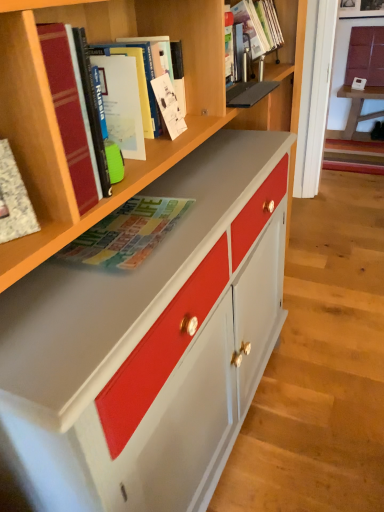
What do you see at coordinates (126, 234) in the screenshot?
I see `matte magazine at center, positioned as the third book in front-to-back order` at bounding box center [126, 234].

What is the approximate height of matte white cabinet at upper right?

matte white cabinet at upper right is 54.57 centimeters tall.

What do you see at coordinates (359, 109) in the screenshot?
I see `matte white table at upper right` at bounding box center [359, 109].

Identify the location of matte hardcover book at upper center, which is counted as the fourth book, starting from the front. (140, 76).

I want to click on white textured notebook at left, which is the 6th book from back to front, so click(14, 199).

Is matte hardcover book at upper center, marked as the 3th book in a back-to-front arrangement, positioned far away from matte plastic book at upper center, the first book positioned from the back?

No, matte hardcover book at upper center, marked as the 3th book in a back-to-front arrangement, is not far from matte plastic book at upper center, the first book positioned from the back.

Is matte hardcover book at upper center, marked as the 3th book in a back-to-front arrangement, facing towards matte plastic book at upper center, the first book positioned from the back?

No, matte hardcover book at upper center, marked as the 3th book in a back-to-front arrangement, is not aimed at matte plastic book at upper center, the first book positioned from the back.

Considering the sizes of objects matte hardcover book at upper center, which is counted as the fourth book, starting from the front, and matte plastic book at upper center, the first book positioned from the back, in the image provided, who is thinner, matte hardcover book at upper center, which is counted as the fourth book, starting from the front, or matte plastic book at upper center, the first book positioned from the back,?

matte hardcover book at upper center, which is counted as the fourth book, starting from the front.

Is point (114, 51) farther from viewer compared to point (274, 49)?

No, it is in front of (274, 49).

Is white paper at upper center, which appears as the fifth book when viewed from the front, outside of hardcover book at upper left, which ranks as the 5th book in back-to-front order?

Yes, white paper at upper center, which appears as the fifth book when viewed from the front, is outside of hardcover book at upper left, which ranks as the 5th book in back-to-front order.

Considering the relative sizes of white paper at upper center, which appears as the fifth book when viewed from the front, and hardcover book at upper left, which ranks as the 5th book in back-to-front order, in the image provided, is white paper at upper center, which appears as the fifth book when viewed from the front, wider than hardcover book at upper left, which ranks as the 5th book in back-to-front order,?

In fact, white paper at upper center, which appears as the fifth book when viewed from the front, might be narrower than hardcover book at upper left, which ranks as the 5th book in back-to-front order.

The height and width of the screenshot is (512, 384). Identify the location of the 3rd book behind when counting from the hardcover book at upper left, positioned as the second book in front-to-back order. (168, 105).

Is there a large distance between white paper at upper center, the second book from the back, and hardcover book at upper left, positioned as the second book in front-to-back order?

No, white paper at upper center, the second book from the back, is in close proximity to hardcover book at upper left, positioned as the second book in front-to-back order.

Consider the image. From a real-world perspective, is hardcover book at upper left, positioned as the second book in front-to-back order, positioned above or below matte plastic book at upper center, which is the 6th book from front to back?

Clearly, from a real-world perspective, hardcover book at upper left, positioned as the second book in front-to-back order, is below matte plastic book at upper center, which is the 6th book from front to back.

Is hardcover book at upper left, which ranks as the 5th book in back-to-front order, positioned far away from matte plastic book at upper center, which is the 6th book from front to back?

That's right, there is a large distance between hardcover book at upper left, which ranks as the 5th book in back-to-front order, and matte plastic book at upper center, which is the 6th book from front to back.

Between hardcover book at upper left, positioned as the second book in front-to-back order, and matte plastic book at upper center, the first book positioned from the back, which one has larger width?

hardcover book at upper left, positioned as the second book in front-to-back order.

From the picture: Is matte hardcover book at upper center, which is counted as the fourth book, starting from the front, bigger than matte white cabinet at upper right?

No, matte hardcover book at upper center, which is counted as the fourth book, starting from the front, is not bigger than matte white cabinet at upper right.

Does matte hardcover book at upper center, which is counted as the fourth book, starting from the front, have a greater width compared to matte white cabinet at upper right?

Correct, the width of matte hardcover book at upper center, which is counted as the fourth book, starting from the front, exceeds that of matte white cabinet at upper right.

Is matte hardcover book at upper center, marked as the 3th book in a back-to-front arrangement, inside or outside of matte white cabinet at upper right?

matte hardcover book at upper center, marked as the 3th book in a back-to-front arrangement, cannot be found inside matte white cabinet at upper right.

Between matte hardcover book at upper center, which is counted as the fourth book, starting from the front, and matte white cabinet at upper right, which one has less height?

matte hardcover book at upper center, which is counted as the fourth book, starting from the front.

Locate an element on the screen. The width and height of the screenshot is (384, 512). table that appears below the white paper at upper center, which appears as the fifth book when viewed from the front (from a real-world perspective) is located at coordinates (359, 109).

Is white paper at upper center, which appears as the fifth book when viewed from the front, in contact with matte white table at upper right?

There is a gap between white paper at upper center, which appears as the fifth book when viewed from the front, and matte white table at upper right.

Considering the sizes of white paper at upper center, which appears as the fifth book when viewed from the front, and matte white table at upper right in the image, is white paper at upper center, which appears as the fifth book when viewed from the front, bigger or smaller than matte white table at upper right?

Considering their sizes, white paper at upper center, which appears as the fifth book when viewed from the front, takes up less space than matte white table at upper right.

Between white paper at upper center, which appears as the fifth book when viewed from the front, and matte white table at upper right, which one is positioned behind?

matte white table at upper right is further away from the camera.

Can you confirm if matte plastic book at upper center, the first book positioned from the back, is bigger than white textured notebook at left, which is the 6th book from back to front?

Correct, matte plastic book at upper center, the first book positioned from the back, is larger in size than white textured notebook at left, which is the 6th book from back to front.

Considering their positions, is matte plastic book at upper center, the first book positioned from the back, located in front of or behind white textured notebook at left, which is the 6th book from back to front?

matte plastic book at upper center, the first book positioned from the back, is positioned farther from the viewer than white textured notebook at left, which is the 6th book from back to front.

Considering the relative sizes of matte plastic book at upper center, the first book positioned from the back, and white textured notebook at left, which is the 6th book from back to front, in the image provided, is matte plastic book at upper center, the first book positioned from the back, thinner than white textured notebook at left, which is the 6th book from back to front,?

No, matte plastic book at upper center, the first book positioned from the back, is not thinner than white textured notebook at left, which is the 6th book from back to front.

Consider the image. Can we say matte plastic book at upper center, the first book positioned from the back, lies outside white textured notebook at left, which is counted as the 1th book, starting from the front?

Indeed, matte plastic book at upper center, the first book positioned from the back, is completely outside white textured notebook at left, which is counted as the 1th book, starting from the front.

Are matte plastic book at upper center, which is the 6th book from front to back, and matte magazine at center, acting as the fourth book starting from the back, far apart?

No, there isn't a large distance between matte plastic book at upper center, which is the 6th book from front to back, and matte magazine at center, acting as the fourth book starting from the back.

Is matte plastic book at upper center, the first book positioned from the back, taller or shorter than matte magazine at center, positioned as the third book in front-to-back order?

In the image, matte plastic book at upper center, the first book positioned from the back, appears to be taller than matte magazine at center, positioned as the third book in front-to-back order.

Which object is thinner, matte plastic book at upper center, which is the 6th book from front to back, or matte magazine at center, acting as the fourth book starting from the back?

With smaller width is matte plastic book at upper center, which is the 6th book from front to back.

From the image's perspective, which is below, matte plastic book at upper center, which is the 6th book from front to back, or matte magazine at center, acting as the fourth book starting from the back?

matte magazine at center, acting as the fourth book starting from the back, is shown below in the image.

Find the location of a particular element. This screenshot has height=512, width=384. book that is the 1st object located below the matte plastic book at upper center, the first book positioned from the back (from the image's perspective) is located at coordinates (140, 76).

Where is `book that is the 3rd object located in front of the white paper at upper center, the second book from the back`? The width and height of the screenshot is (384, 512). book that is the 3rd object located in front of the white paper at upper center, the second book from the back is located at coordinates (71, 111).

From the image, which object appears to be farther from white textured notebook at left, which is counted as the 1th book, starting from the front, matte magazine at center, positioned as the third book in front-to-back order, or white paper at upper center, which appears as the fifth book when viewed from the front?

white paper at upper center, which appears as the fifth book when viewed from the front, is positioned further to the anchor white textured notebook at left, which is counted as the 1th book, starting from the front.

From the picture: Estimate the real-world distances between objects in this image. Which object is closer to white paper at upper center, which appears as the fifth book when viewed from the front, matte white table at upper right or matte paper map at upper left?

The object closer to white paper at upper center, which appears as the fifth book when viewed from the front, is matte paper map at upper left.

Considering their positions, is hardcover book at upper left, which ranks as the 5th book in back-to-front order, positioned further to matte white cabinet at upper right than matte white table at upper right?

Based on the image, hardcover book at upper left, which ranks as the 5th book in back-to-front order, appears to be further to matte white cabinet at upper right.

Looking at the image, which one is located further to hardcover book at upper left, positioned as the second book in front-to-back order, matte white cabinet at upper right or white paper at upper center, the second book from the back?

matte white cabinet at upper right is positioned further to the anchor hardcover book at upper left, positioned as the second book in front-to-back order.

Based on their spatial positions, is matte plastic book at upper center, the first book positioned from the back, or white paper at upper center, which appears as the fifth book when viewed from the front, further from white textured notebook at left, which is counted as the 1th book, starting from the front?

matte plastic book at upper center, the first book positioned from the back, is positioned further to the anchor white textured notebook at left, which is counted as the 1th book, starting from the front.

Estimate the real-world distances between objects in this image. Which object is further from matte magazine at center, acting as the fourth book starting from the back, matte hardcover book at upper center, which is counted as the fourth book, starting from the front, or white textured notebook at left, which is counted as the 1th book, starting from the front?

Among the two, matte hardcover book at upper center, which is counted as the fourth book, starting from the front, is located further to matte magazine at center, acting as the fourth book starting from the back.

Based on their spatial positions, is hardcover book at upper left, which ranks as the 5th book in back-to-front order, or matte white table at upper right closer to matte paper map at upper left?

The object closer to matte paper map at upper left is hardcover book at upper left, which ranks as the 5th book in back-to-front order.

Based on their spatial positions, is matte paper map at upper left or hardcover book at upper left, positioned as the second book in front-to-back order, further from matte white table at upper right?

hardcover book at upper left, positioned as the second book in front-to-back order, is further to matte white table at upper right.

Identify the location of book between white paper at upper center, the second book from the back, and matte white table at upper right in the front-back direction. This screenshot has height=512, width=384. (259, 25).

The image size is (384, 512). Find the location of `paperback book located between hardcover book at upper left, which ranks as the 5th book in back-to-front order, and matte hardcover book at upper center, marked as the 3th book in a back-to-front arrangement, in the depth direction`. paperback book located between hardcover book at upper left, which ranks as the 5th book in back-to-front order, and matte hardcover book at upper center, marked as the 3th book in a back-to-front arrangement, in the depth direction is located at coordinates (122, 103).

Where is `table located between matte plastic book at upper center, which is the 6th book from front to back, and matte white cabinet at upper right in the depth direction`? The image size is (384, 512). table located between matte plastic book at upper center, which is the 6th book from front to back, and matte white cabinet at upper right in the depth direction is located at coordinates (359, 109).

In order to click on table positioned between white paper at upper center, which appears as the fifth book when viewed from the front, and matte white cabinet at upper right from near to far in this screenshot , I will do `click(359, 109)`.